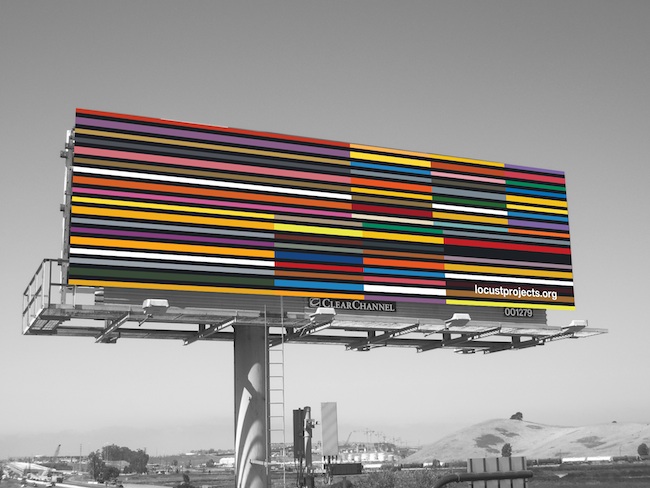
The height and width of the screenshot is (488, 650). What are the coordinates of `metallic ladder` in the screenshot? It's located at (265, 337).